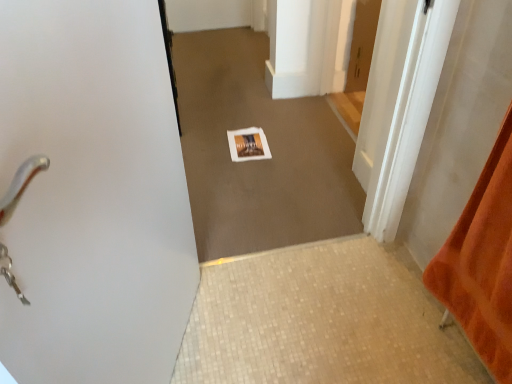
Where is `free location to the left of orange fabric at right`? This screenshot has height=384, width=512. free location to the left of orange fabric at right is located at coordinates (384, 345).